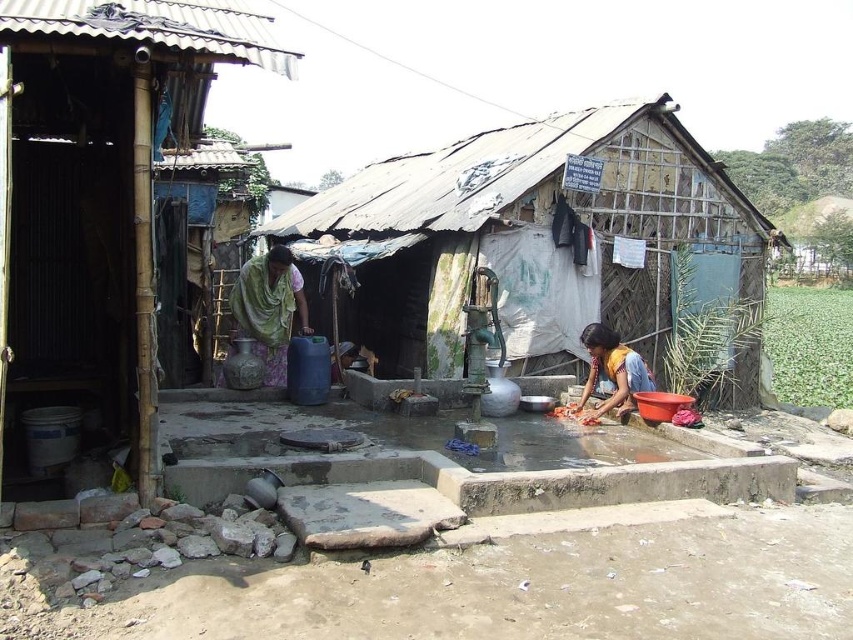
Does rustic bamboo hut at left have a smaller size compared to yellow fabric dress at lower right?

No.

Is point (70, 122) closer to camera compared to point (642, 368)?

Yes.

What are the coordinates of `rustic bamboo hut at left` in the screenshot? It's located at (96, 198).

Is rusty corrugated metal hut at center further to the viewer compared to yellow fabric dress at lower right?

Yes, rusty corrugated metal hut at center is further from the viewer.

Describe the element at coordinates (544, 237) in the screenshot. I see `rusty corrugated metal hut at center` at that location.

What do you see at coordinates (544, 237) in the screenshot?
I see `rusty corrugated metal hut at center` at bounding box center [544, 237].

Where is `rusty corrugated metal hut at center`? The image size is (853, 640). rusty corrugated metal hut at center is located at coordinates (544, 237).

Does rustic bamboo hut at left have a greater height compared to green fabric shawl at center?

Yes.

Between point (102, 209) and point (299, 304), which one is positioned behind?

The point (299, 304) is behind.

Identify the location of rustic bamboo hut at left. (96, 198).